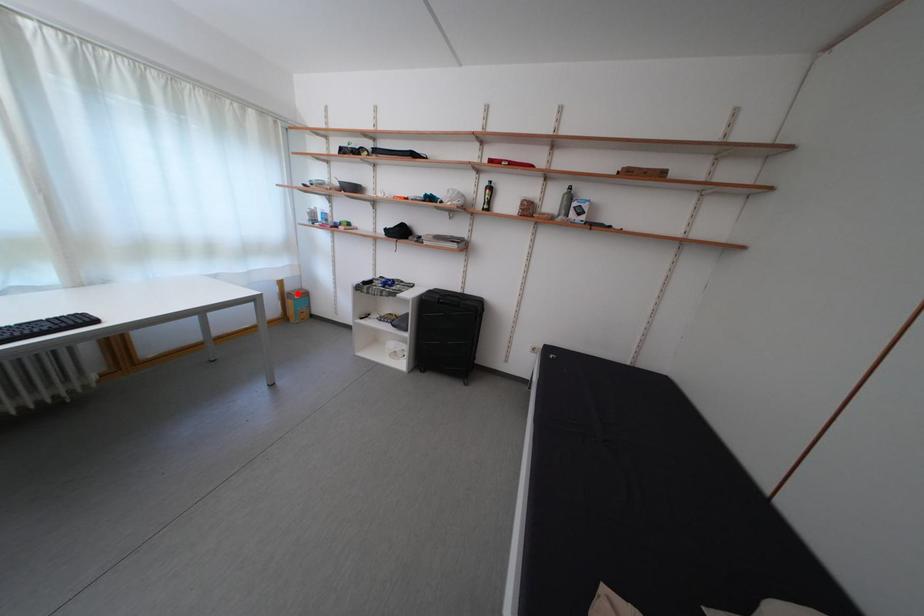
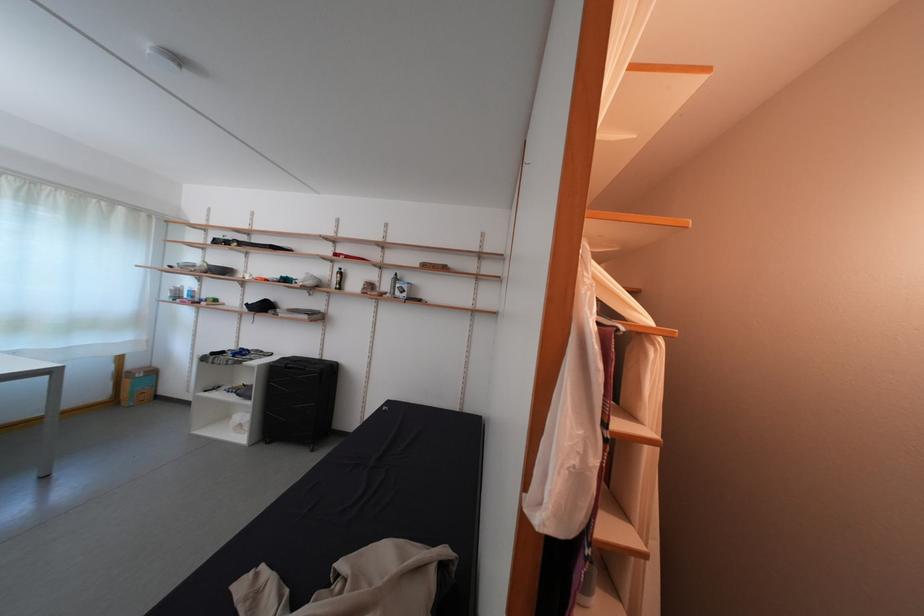
Question: I am providing you with two images of the same scene from different viewpoints. Given a red point in image1, look at the same physical point in image2. Is it:

Choices:
 (A) Closer to the viewpoint
 (B) Farther from the viewpoint

Answer: (A)